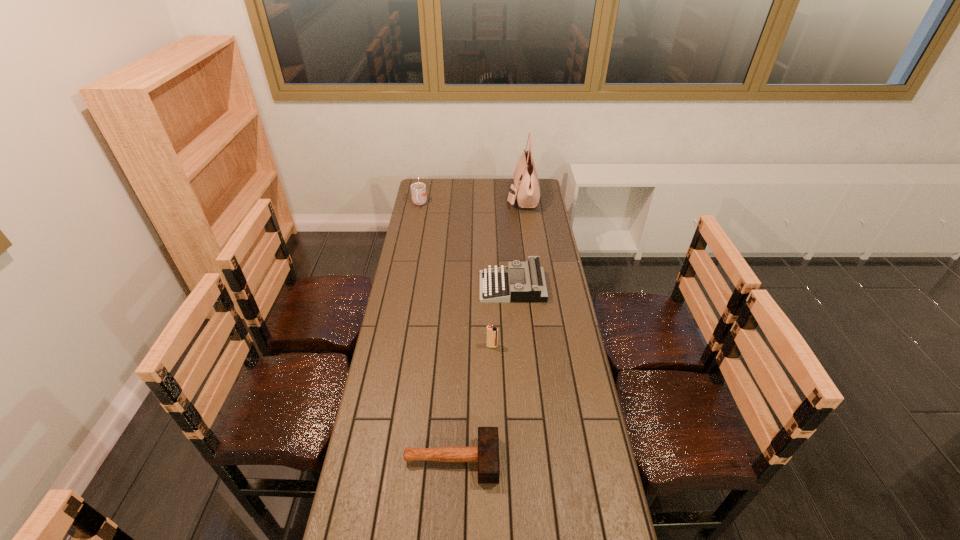
The image size is (960, 540). Find the location of `mallet present at the left edge`. mallet present at the left edge is located at coordinates (486, 454).

The height and width of the screenshot is (540, 960). I want to click on handbag located at the right edge, so click(526, 189).

Find the location of a particular element. The width and height of the screenshot is (960, 540). typewriter that is positioned at the right edge is located at coordinates (532, 287).

You are a GUI agent. You are given a task and a screenshot of the screen. Output one action in this format:
    pyautogui.click(x=<x>, y=<y>)
    Task: Click on the object that is at the far left corner
    This screenshot has height=540, width=960.
    Given the screenshot: What is the action you would take?
    pyautogui.click(x=418, y=190)

Find the location of `object at the far right corner`. object at the far right corner is located at coordinates (526, 189).

Locate an element on the screen. The image size is (960, 540). free space at the left edge is located at coordinates (418, 306).

This screenshot has height=540, width=960. Find the location of `free space at the right edge`. free space at the right edge is located at coordinates (536, 212).

Locate an element on the screen. The image size is (960, 540). free space between the cup and the shortest object is located at coordinates (436, 332).

Locate an element on the screen. The width and height of the screenshot is (960, 540). free space between the tallest object and the mallet is located at coordinates (487, 328).

The image size is (960, 540). I want to click on vacant area that lies between the nearest object and the fourth shortest object, so click(436, 332).